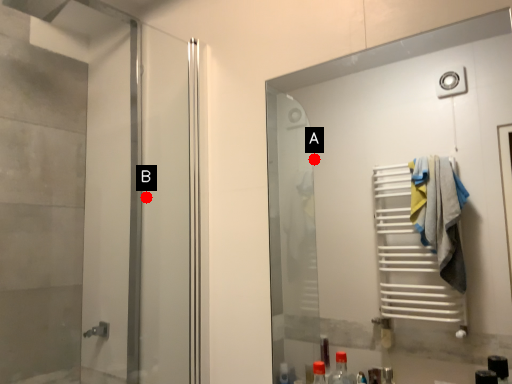
Question: Two points are circled on the image, labeled by A and B beside each circle. Which point is farther to the camera?

Choices:
 (A) A is further
 (B) B is further

Answer: (A)